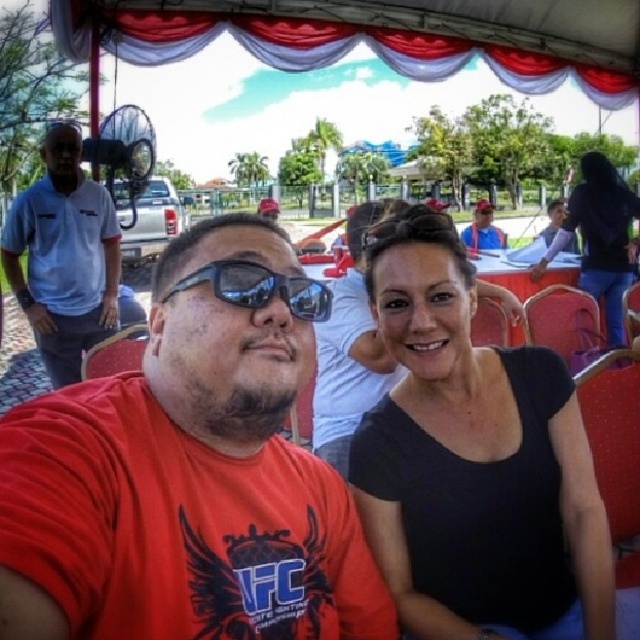
Question: Is black matte shirt at center below matte blue shirt at upper right?

Choices:
 (A) yes
 (B) no

Answer: (A)

Question: Which object appears farthest from the camera in this image?

Choices:
 (A) matte blue shirt at upper right
 (B) matte red t-shirt at center
 (C) light blue cotton polo shirt at left

Answer: (A)

Question: Based on their relative distances, which object is nearer to the light blue cotton polo shirt at left?

Choices:
 (A) black plastic sunglasses at center
 (B) black matte shirt at center

Answer: (B)

Question: Is matte red t-shirt at center wider than matte blue shirt at upper right?

Choices:
 (A) yes
 (B) no

Answer: (B)

Question: Which object is farther from the camera taking this photo?

Choices:
 (A) black plastic sunglasses at center
 (B) matte blue shirt at upper right

Answer: (B)

Question: Is light blue cotton polo shirt at left above matte blue shirt at upper right?

Choices:
 (A) no
 (B) yes

Answer: (A)